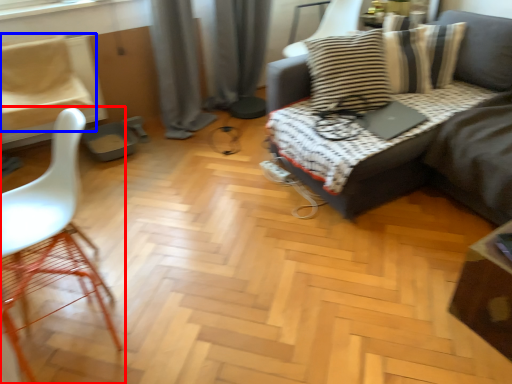
Question: Which point is further to the camera, chair (highlighted by a red box) or chair (highlighted by a blue box)?

Choices:
 (A) chair
 (B) chair

Answer: (B)